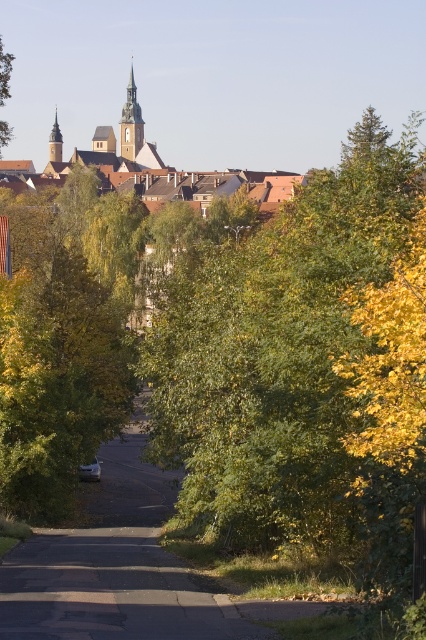
Is white asphalt road at center below brown tiled roofs at upper center?

Correct, white asphalt road at center is located below brown tiled roofs at upper center.

Is white asphalt road at center shorter than brown tiled roofs at upper center?

Indeed, white asphalt road at center has a lesser height compared to brown tiled roofs at upper center.

Is point (60, 547) positioned before point (265, 186)?

Yes.

Where is `white asphalt road at center`? white asphalt road at center is located at coordinates (114, 566).

Can you confirm if brown tiled roofs at upper center is positioned to the right of green leafy tree at upper left?

Incorrect, brown tiled roofs at upper center is not on the right side of green leafy tree at upper left.

Is point (195, 193) positioned in front of point (0, 156)?

Yes, point (195, 193) is in front of point (0, 156).

Locate an element on the screen. brown tiled roofs at upper center is located at coordinates (154, 168).

I want to click on white asphalt road at center, so click(114, 566).